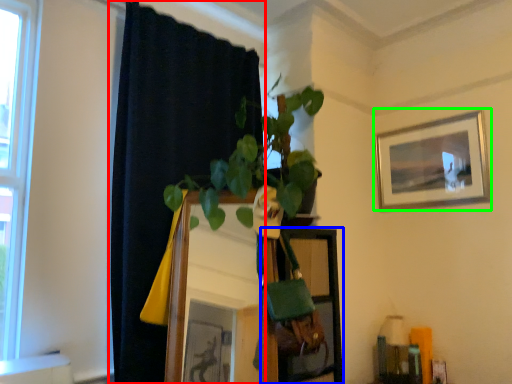
Question: Which object is the closest to the curtain (highlighted by a red box)? Choose among these: shelf (highlighted by a blue box) or picture frame (highlighted by a green box).

Choices:
 (A) shelf
 (B) picture frame

Answer: (A)